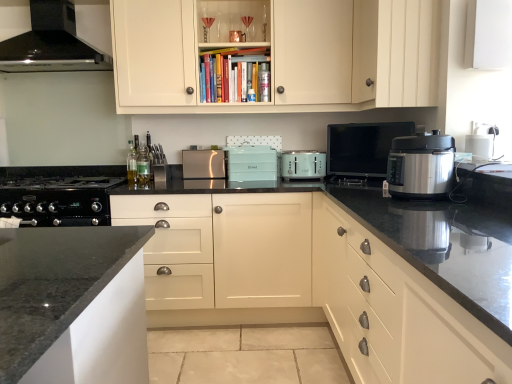
This screenshot has height=384, width=512. I want to click on vacant space situated above black glossy television at upper right, which is counted as the 2th kitchen appliance, starting from the right (from a real-world perspective), so click(x=355, y=127).